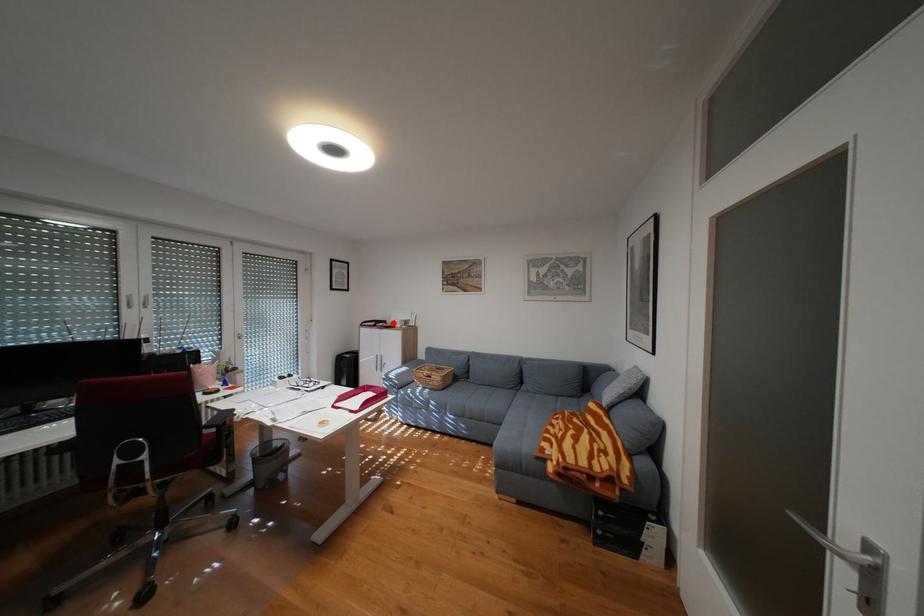
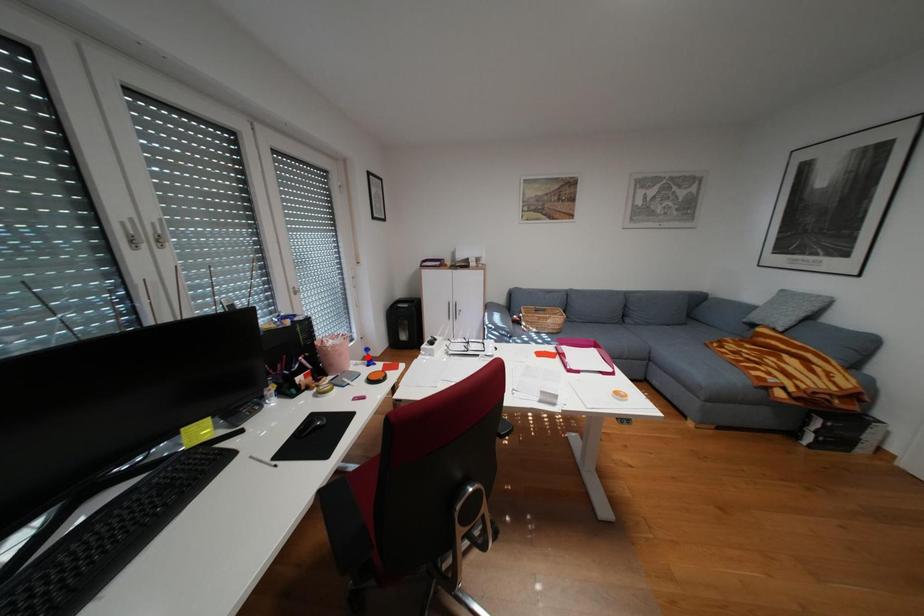
I am providing you with two images of the same scene from different viewpoints. A red point is marked on the first image and another point is marked on the second image. Is the red point in image1 aligned with the point shown in image2?

No